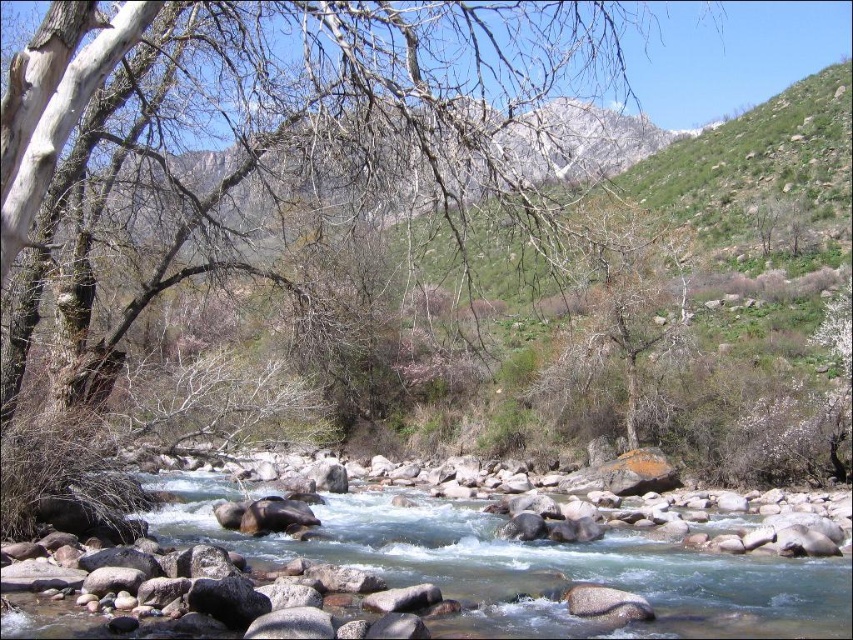
Question: Is smooth bark tree at center closer to the viewer compared to smooth gray rocks at center?

Choices:
 (A) yes
 (B) no

Answer: (A)

Question: Does smooth bark tree at center appear on the right side of smooth gray rocks at center?

Choices:
 (A) no
 (B) yes

Answer: (B)

Question: Which point is closer to the camera?

Choices:
 (A) gray bark tree at center
 (B) smooth bark tree at center

Answer: (B)

Question: Which point appears farthest from the camera in this image?

Choices:
 (A) (155, 24)
 (B) (386, 518)
 (C) (643, 396)

Answer: (C)

Question: Among these objects, which one is nearest to the camera?

Choices:
 (A) gray bark tree at center
 (B) smooth gray rocks at center
 (C) smooth bark tree at center

Answer: (C)

Question: Is smooth bark tree at center thinner than smooth gray rocks at center?

Choices:
 (A) yes
 (B) no

Answer: (B)